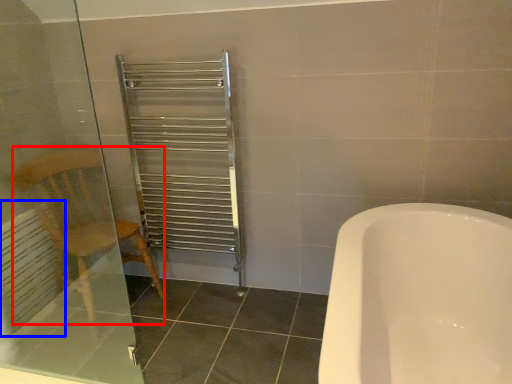
Question: Which point is closer to the camera, armchair (highlighted by a red box) or radiator (highlighted by a blue box)?

Choices:
 (A) armchair
 (B) radiator

Answer: (A)